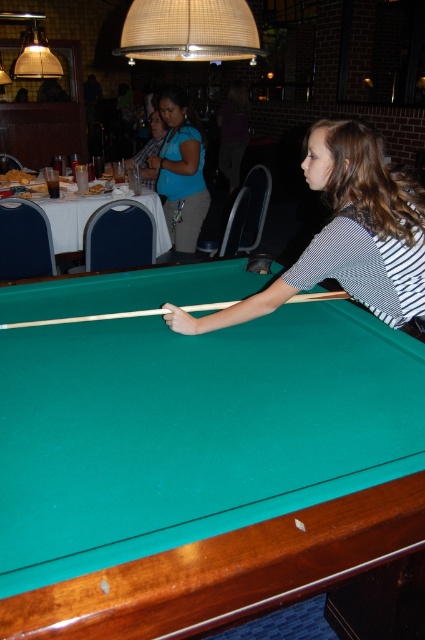
Can you confirm if striped shirt at center is smaller than wooden pool cue at center?

No, striped shirt at center is not smaller than wooden pool cue at center.

Is point (277, 289) in front of point (187, 305)?

Yes, it is.

You are a GUI agent. You are given a task and a screenshot of the screen. Output one action in this format:
    pyautogui.click(x=<x>, y=<y>)
    Task: Click on the striped shirt at center
    Image resolution: width=425 pixels, height=640 pixels.
    Given the screenshot: What is the action you would take?
    pyautogui.click(x=346, y=234)

Does green felt billiard table at center come in front of striped shirt at center?

Yes, green felt billiard table at center is closer to the viewer.

Between green felt billiard table at center and striped shirt at center, which one has less height?

Result: striped shirt at center is shorter.

Is point (368, 323) more distant than point (363, 168)?

Yes, it is behind point (363, 168).

Find the location of `green felt billiard table at center`. green felt billiard table at center is located at coordinates (200, 467).

Who is lower down, striped shirt at center or matte blue shirt at upper center?

striped shirt at center is lower down.

Does striped shirt at center have a lesser height compared to matte blue shirt at upper center?

Indeed, striped shirt at center has a lesser height compared to matte blue shirt at upper center.

Image resolution: width=425 pixels, height=640 pixels. What do you see at coordinates (346, 234) in the screenshot?
I see `striped shirt at center` at bounding box center [346, 234].

The image size is (425, 640). Identify the location of striped shirt at center. (346, 234).